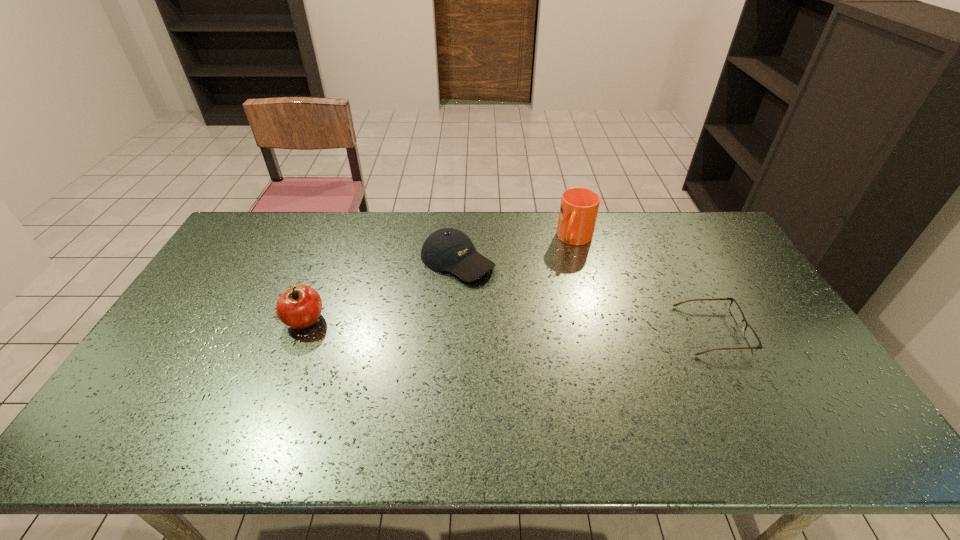
Where is `vacant area situated on the handle side of the second object from right to left`? The height and width of the screenshot is (540, 960). vacant area situated on the handle side of the second object from right to left is located at coordinates [553, 313].

Where is `vacant region located on the handle side of the second object from right to left`? The image size is (960, 540). vacant region located on the handle side of the second object from right to left is located at coordinates (553, 311).

Where is `vacant space situated 0.250m on the handle side of the second object from right to left`? This screenshot has width=960, height=540. vacant space situated 0.250m on the handle side of the second object from right to left is located at coordinates (x=557, y=302).

Identify the location of free location located on the front-facing side of the second shortest object. (506, 291).

This screenshot has width=960, height=540. Identify the location of free space located 0.190m on the front-facing side of the second shortest object. (531, 307).

At what (x,y) coordinates should I click in order to perform the action: click on vacant space situated 0.120m on the front-facing side of the second shortest object. Please return your answer as a coordinate pair (x, y). Looking at the image, I should click on click(513, 295).

You are a GUI agent. You are given a task and a screenshot of the screen. Output one action in this format:
    pyautogui.click(x=<x>, y=<y>)
    Task: Click on the mug present at the far edge
    This screenshot has height=540, width=960.
    Given the screenshot: What is the action you would take?
    pyautogui.click(x=579, y=206)

Locate an element on the screen. Image resolution: width=960 pixels, height=540 pixels. baseball cap located at the far edge is located at coordinates (448, 249).

I want to click on object situated at the right edge, so click(x=751, y=337).

At what (x,y) coordinates should I click in order to perform the action: click on vacant space at the far edge of the desktop. Please return your answer as a coordinate pair (x, y). The height and width of the screenshot is (540, 960). Looking at the image, I should click on (296, 219).